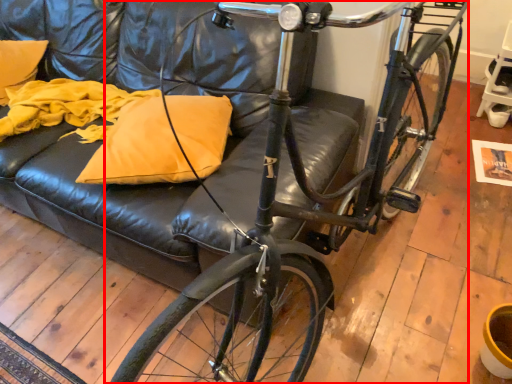
Question: From the image, what is the correct spatial relationship of bicycle (annotated by the red box) in relation to pillow?

Choices:
 (A) right
 (B) left

Answer: (A)